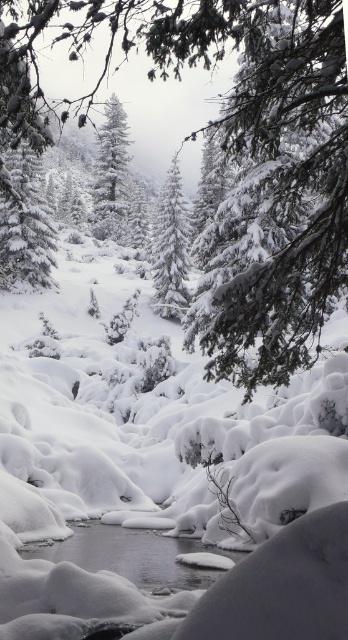
Who is positioned more to the left, white snow-covered tree at center or snow-covered evergreen tree at center?

snow-covered evergreen tree at center is more to the left.

What do you see at coordinates (170, 248) in the screenshot? I see `white snow-covered tree at center` at bounding box center [170, 248].

This screenshot has height=640, width=348. I want to click on white snow-covered tree at center, so click(170, 248).

Does green textured pine branch at upper right appear on the right side of snow-covered evergreen tree at center?

Indeed, green textured pine branch at upper right is positioned on the right side of snow-covered evergreen tree at center.

Can you confirm if green textured pine branch at upper right is smaller than snow-covered evergreen tree at center?

Yes, green textured pine branch at upper right is smaller than snow-covered evergreen tree at center.

Which is in front, point (346, 272) or point (104, 237)?

Point (346, 272) is in front.

Locate an element on the screen. The image size is (348, 640). green textured pine branch at upper right is located at coordinates (287, 202).

Measure the distance from clear ice stream at center to snow-covered evergreen tree at center.

clear ice stream at center is 83.11 meters from snow-covered evergreen tree at center.

Is point (107, 538) in front of point (99, 134)?

Yes.

The height and width of the screenshot is (640, 348). What are the coordinates of `clear ice stream at center` in the screenshot? It's located at (130, 554).

Locate an element on the screen. Image resolution: width=348 pixels, height=640 pixels. clear ice stream at center is located at coordinates 130,554.